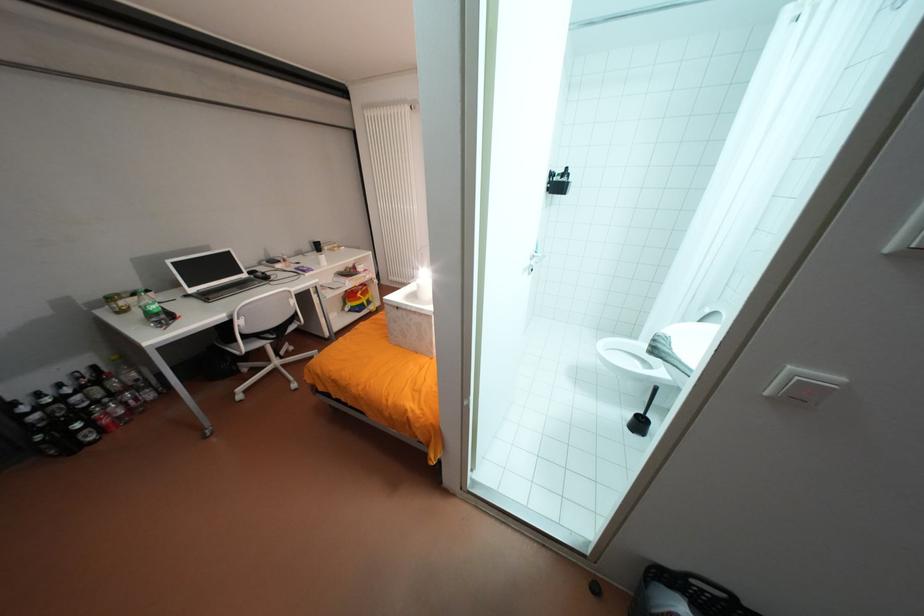
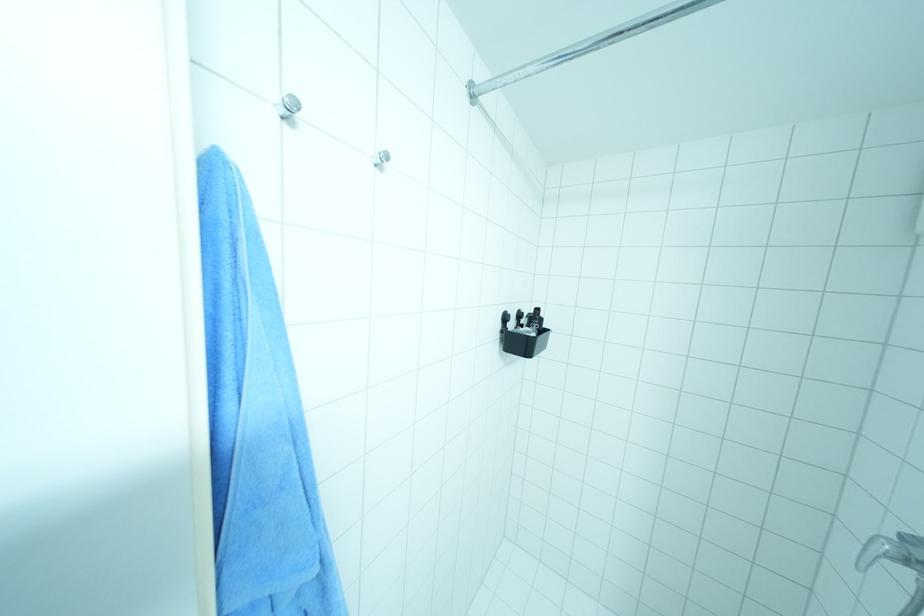
Based on the photo, which direction would the cameraman need to move to produce the second image?

The cameraman moved toward right, forward.